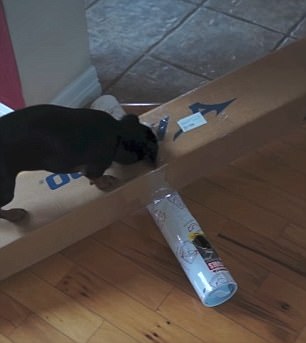
At what (x,y) coordinates should I click in order to perform the action: click on tile flooring. Please return your answer as a coordinate pair (x, y). The width and height of the screenshot is (306, 343). Looking at the image, I should click on 183,49.